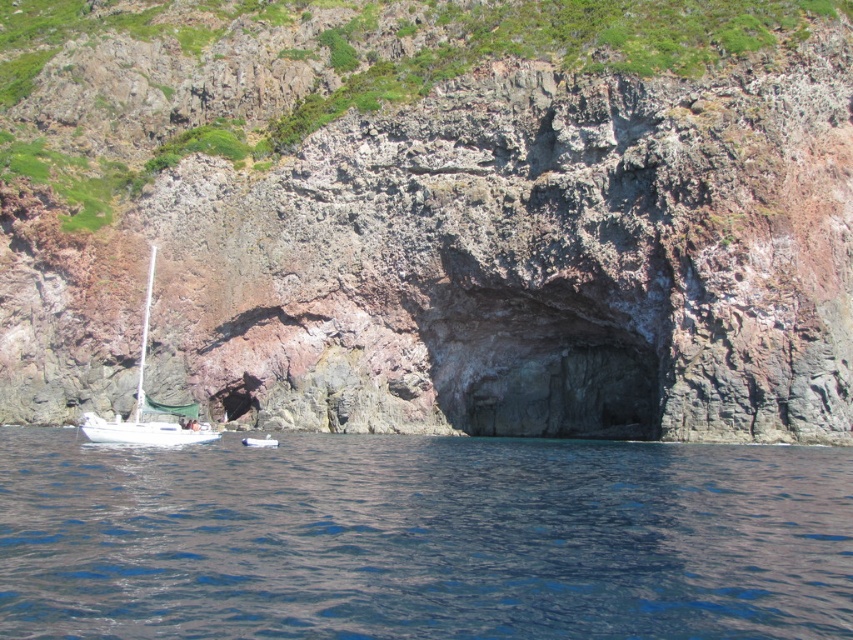
Question: Is the position of rusty rock cliff at center less distant than that of blue water at lower left?

Choices:
 (A) no
 (B) yes

Answer: (A)

Question: Which point is closer to the camera taking this photo?

Choices:
 (A) (325, 616)
 (B) (250, 440)

Answer: (A)

Question: Among these points, which one is nearest to the camera?

Choices:
 (A) (x=585, y=241)
 (B) (x=453, y=560)

Answer: (B)

Question: Is white matte sailboat at lower left above white matte boat at lower left?

Choices:
 (A) yes
 (B) no

Answer: (A)

Question: Based on their relative distances, which object is farther from the white matte sailboat at lower left?

Choices:
 (A) rusty rock cliff at center
 (B) white matte boat at lower left

Answer: (A)

Question: Is blue water at lower left closer to camera compared to white matte boat at lower left?

Choices:
 (A) yes
 (B) no

Answer: (A)